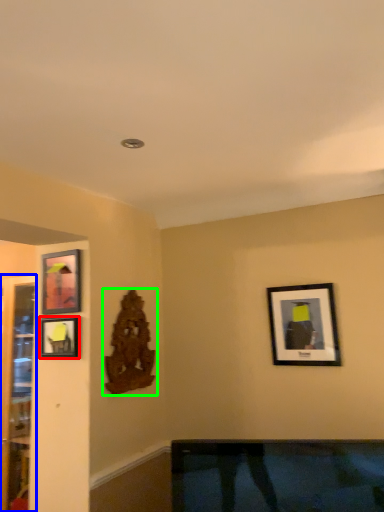
Question: Estimate the real-world distances between objects in this image. Which object is closer to picture frame (highlighted by a red box), glass door (highlighted by a blue box) or art (highlighted by a green box)?

Choices:
 (A) glass door
 (B) art

Answer: (B)